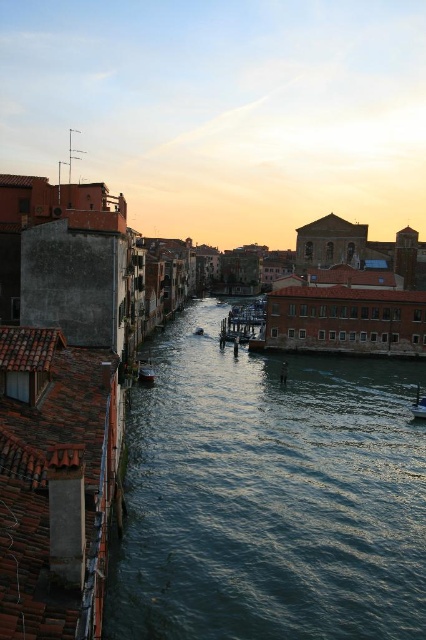
You are a tourist standing on the left bank of the canal and want to take a photo of the wooden polished boat at center. Where should you position yourself to ensure the boat is in the center of your photo?

You should position yourself directly across from the wooden polished boat at center, which is located at coordinates point (146, 371), to ensure it is centered in your photo.

You are an observer standing on the left side of the canal. You see the wooden polished boat at center and the metallic silver boat at center. Which boat is closer to your current position?

The wooden polished boat at center is closer to your current position because it is positioned on the left side of the metallic silver boat at center, and you are standing on the left side of the canal.

You are standing on a boat in the middle of the canal and want to reach the closest point to the camera between the two points, point [382,522] and point [423,401]. Which point should you navigate towards?

You should navigate towards point [382,522] because it is closer to the camera than point [423,401].